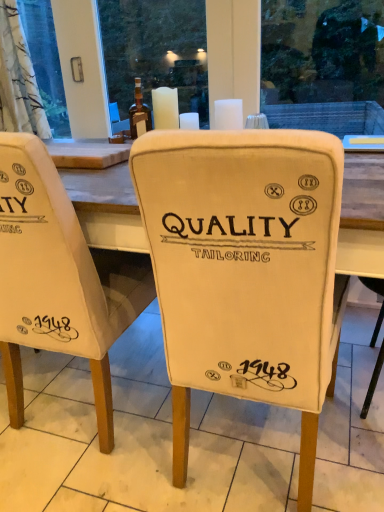
Question: Is translucent glass bottle at center a part of white wax candle at upper center, arranged as the 2th candle when viewed from the right?

Choices:
 (A) yes
 (B) no

Answer: (B)

Question: Could you tell me if white wax candle at upper center, arranged as the 2th candle when viewed from the right, is facing translucent glass bottle at center?

Choices:
 (A) yes
 (B) no

Answer: (B)

Question: Is the surface of white wax candle at upper center, the first candle from the left, in direct contact with translucent glass bottle at center?

Choices:
 (A) yes
 (B) no

Answer: (A)

Question: From a real-world perspective, is white wax candle at upper center, arranged as the 2th candle when viewed from the right, physically above translucent glass bottle at center?

Choices:
 (A) no
 (B) yes

Answer: (A)

Question: Considering the relative sizes of white wax candle at upper center, arranged as the 2th candle when viewed from the right, and translucent glass bottle at center in the image provided, is white wax candle at upper center, arranged as the 2th candle when viewed from the right, thinner than translucent glass bottle at center?

Choices:
 (A) no
 (B) yes

Answer: (B)

Question: Does point (44, 249) appear closer or farther from the camera than point (259, 169)?

Choices:
 (A) closer
 (B) farther

Answer: (B)

Question: Looking at the image, does white fabric chair at center, which appears as the 2th chair when viewed from the right, seem bigger or smaller compared to white fabric chair at center, placed as the 2th chair when sorted from left to right?

Choices:
 (A) big
 (B) small

Answer: (B)

Question: Do you think white fabric chair at center, which appears as the 2th chair when viewed from the right, is within white fabric chair at center, placed as the 2th chair when sorted from left to right, or outside of it?

Choices:
 (A) inside
 (B) outside

Answer: (B)

Question: Relative to white fabric chair at center, placed as the 2th chair when sorted from left to right, is white fabric chair at center, which appears as the 2th chair when viewed from the right, in front or behind?

Choices:
 (A) behind
 (B) front

Answer: (A)

Question: In the image, is translucent glass bottle at center on the left side or the right side of white fabric chair at center?

Choices:
 (A) left
 (B) right

Answer: (A)

Question: Based on their sizes in the image, would you say translucent glass bottle at center is bigger or smaller than white fabric chair at center?

Choices:
 (A) big
 (B) small

Answer: (B)

Question: From a real-world perspective, relative to white fabric chair at center, is translucent glass bottle at center vertically above or below?

Choices:
 (A) below
 (B) above

Answer: (B)

Question: From the image's perspective, is translucent glass bottle at center located above or below white fabric chair at center?

Choices:
 (A) above
 (B) below

Answer: (A)

Question: Is white fabric chair at center inside or outside of white wax candle at upper center, arranged as the 2th candle when viewed from the right?

Choices:
 (A) outside
 (B) inside

Answer: (A)

Question: From a real-world perspective, relative to white wax candle at upper center, the first candle from the left, is white fabric chair at center vertically above or below?

Choices:
 (A) below
 (B) above

Answer: (A)